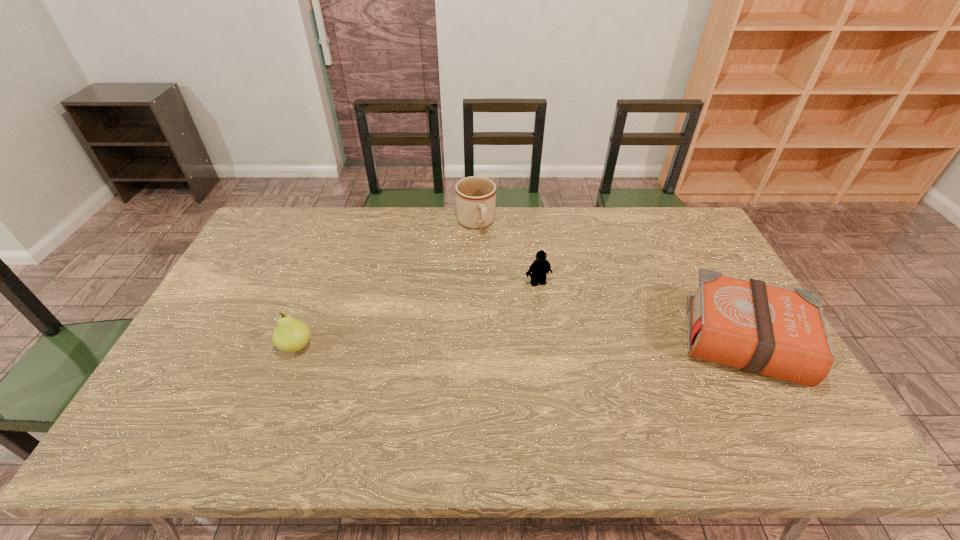
What are the coordinates of `vacant space at the left edge of the desktop` in the screenshot? It's located at pos(239,266).

Locate an element on the screen. The height and width of the screenshot is (540, 960). vacant point at the right edge is located at coordinates (681, 256).

The width and height of the screenshot is (960, 540). I want to click on free space at the far left corner, so click(x=304, y=218).

Identify the location of vacant position at the near right corner of the desktop. The image size is (960, 540). (745, 389).

This screenshot has height=540, width=960. I want to click on vacant space that's between the second object from left to right and the leftmost object, so click(x=386, y=285).

You are a GUI agent. You are given a task and a screenshot of the screen. Output one action in this format:
    pyautogui.click(x=<x>, y=<y>)
    Task: Click on the vacant space in between the Bible and the third nearest object
    The height and width of the screenshot is (540, 960).
    Given the screenshot: What is the action you would take?
    pyautogui.click(x=641, y=312)

You are a GUI agent. You are given a task and a screenshot of the screen. Output one action in this format:
    pyautogui.click(x=<x>, y=<y>)
    Task: Click on the vacant area that lies between the rightmost object and the leftmost object
    Image resolution: width=960 pixels, height=540 pixels.
    Given the screenshot: What is the action you would take?
    pyautogui.click(x=520, y=344)

Where is `vacant region between the Bible and the second object from right to left`? Image resolution: width=960 pixels, height=540 pixels. vacant region between the Bible and the second object from right to left is located at coordinates (641, 312).

Find the location of a particular element. empty space that is in between the Lego and the leftmost object is located at coordinates (417, 314).

Locate an element on the screen. Image resolution: width=960 pixels, height=540 pixels. empty space between the farthest object and the pear is located at coordinates (386, 285).